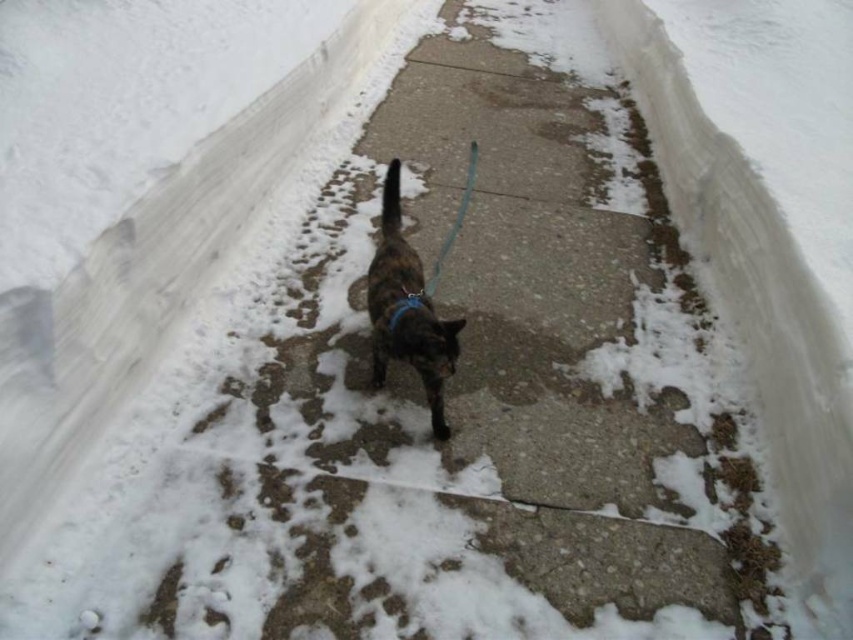
Can you confirm if brown fur cat at center is positioned below teal fabric leash at center?

Yes, brown fur cat at center is below teal fabric leash at center.

Does brown fur cat at center have a greater height compared to teal fabric leash at center?

Yes.

Between point (440, 349) and point (466, 173), which one is positioned behind?

The point (466, 173) is behind.

This screenshot has height=640, width=853. What are the coordinates of `brown fur cat at center` in the screenshot? It's located at (407, 310).